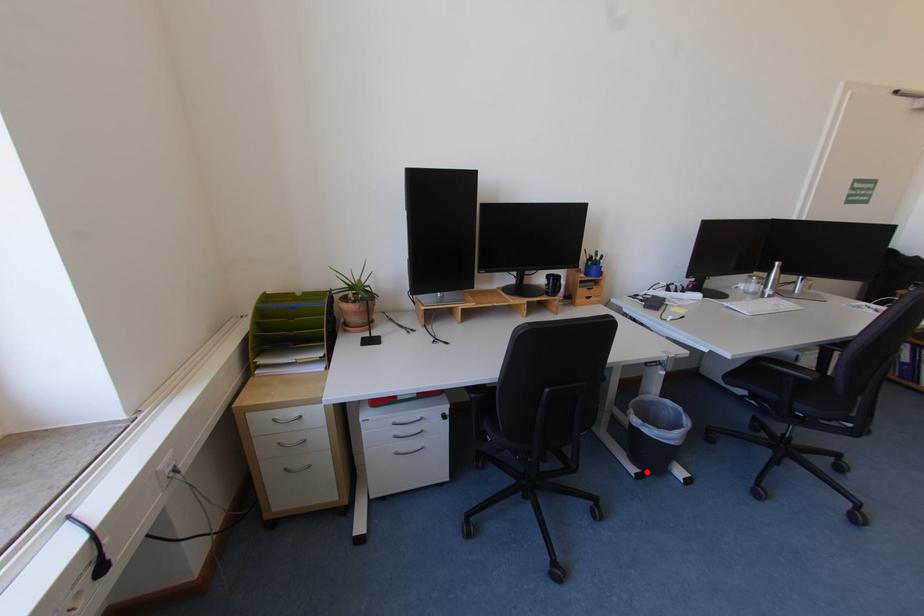
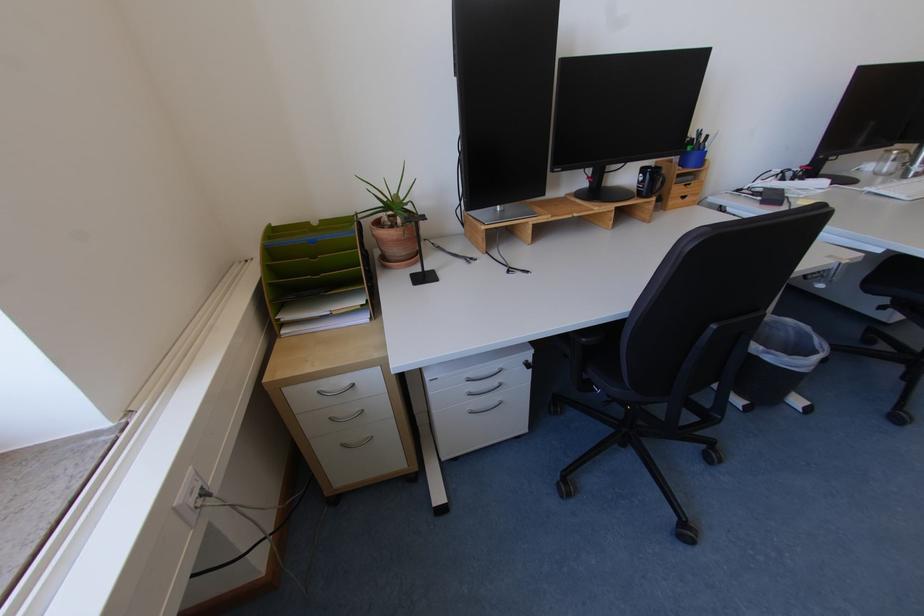
Locate, in the second image, the point that corresponds to the highlighted location in the first image.

(755, 403)